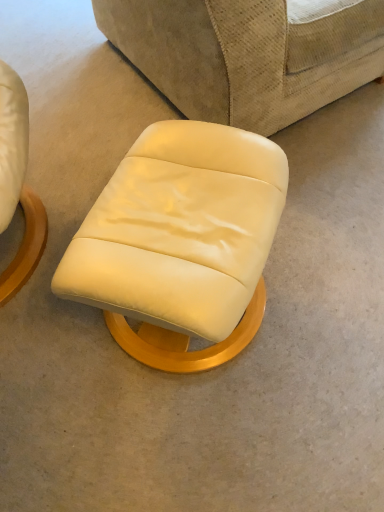
Image resolution: width=384 pixels, height=512 pixels. Find the location of `matte cream leather ottoman at center`. matte cream leather ottoman at center is located at coordinates (181, 242).

Describe the element at coordinates (181, 242) in the screenshot. I see `matte cream leather ottoman at center` at that location.

At what (x,y) coordinates should I click in order to perform the action: click on beige fabric studio couch at center. Please return your answer as a coordinate pair (x, y). Looking at the image, I should click on (246, 55).

Image resolution: width=384 pixels, height=512 pixels. Describe the element at coordinates (246, 55) in the screenshot. I see `beige fabric studio couch at center` at that location.

You are a GUI agent. You are given a task and a screenshot of the screen. Output one action in this format:
    pyautogui.click(x=<x>, y=<y>)
    Task: Click on the matte cream leather ottoman at center
    
    Given the screenshot: What is the action you would take?
    pyautogui.click(x=181, y=242)

From the picture: Does beige fabric studio couch at center appear on the left side of matte cream leather ottoman at center?

In fact, beige fabric studio couch at center is to the right of matte cream leather ottoman at center.

Does beige fabric studio couch at center come behind matte cream leather ottoman at center?

Yes, beige fabric studio couch at center is behind matte cream leather ottoman at center.

From the picture: Which is more distant, (183, 54) or (222, 279)?

Point (183, 54)

From the image's perspective, which one is positioned lower, beige fabric studio couch at center or matte cream leather ottoman at center?

matte cream leather ottoman at center, from the image's perspective.

From a real-world perspective, who is located higher, beige fabric studio couch at center or matte cream leather ottoman at center?

From a 3D spatial view, beige fabric studio couch at center is above.

Considering the relative sizes of beige fabric studio couch at center and matte cream leather ottoman at center in the image provided, is beige fabric studio couch at center wider than matte cream leather ottoman at center?

Correct, the width of beige fabric studio couch at center exceeds that of matte cream leather ottoman at center.

Can you confirm if beige fabric studio couch at center is shorter than matte cream leather ottoman at center?

No.

Does beige fabric studio couch at center have a larger size compared to matte cream leather ottoman at center?

Yes.

Is beige fabric studio couch at center surrounding matte cream leather ottoman at center?

No, matte cream leather ottoman at center is not surrounded by beige fabric studio couch at center.

Is beige fabric studio couch at center positioned far away from matte cream leather ottoman at center?

No, beige fabric studio couch at center is not far away from matte cream leather ottoman at center.

Is matte cream leather ottoman at center at the back of beige fabric studio couch at center?

No, beige fabric studio couch at center is not facing away from matte cream leather ottoman at center.

What are the coordinates of `studio couch on the right side of matte cream leather ottoman at center` in the screenshot? It's located at (246, 55).

Can you confirm if matte cream leather ottoman at center is positioned to the right of beige fabric studio couch at center?

No.

Relative to beige fabric studio couch at center, is matte cream leather ottoman at center in front or behind?

matte cream leather ottoman at center is in front of beige fabric studio couch at center.

Is point (195, 331) positioned behind point (118, 15)?

That is False.

From the image's perspective, which one is positioned lower, matte cream leather ottoman at center or beige fabric studio couch at center?

matte cream leather ottoman at center appears lower in the image.

From a real-world perspective, does matte cream leather ottoman at center stand above beige fabric studio couch at center?

No.

Which of these two, matte cream leather ottoman at center or beige fabric studio couch at center, is thinner?

Thinner between the two is matte cream leather ottoman at center.

Is matte cream leather ottoman at center taller than beige fabric studio couch at center?

No.

Consider the image. Considering the relative sizes of matte cream leather ottoman at center and beige fabric studio couch at center in the image provided, is matte cream leather ottoman at center bigger than beige fabric studio couch at center?

No, matte cream leather ottoman at center is not bigger than beige fabric studio couch at center.

Is matte cream leather ottoman at center located outside beige fabric studio couch at center?

matte cream leather ottoman at center is positioned outside beige fabric studio couch at center.

Is the surface of matte cream leather ottoman at center in direct contact with beige fabric studio couch at center?

No, matte cream leather ottoman at center is not touching beige fabric studio couch at center.

Is beige fabric studio couch at center at the back of matte cream leather ottoman at center?

No.

Identify the location of studio couch behind the matte cream leather ottoman at center. This screenshot has height=512, width=384. (246, 55).

Where is `chair below the beige fabric studio couch at center (from a real-world perspective)`? This screenshot has height=512, width=384. chair below the beige fabric studio couch at center (from a real-world perspective) is located at coordinates coord(181,242).

You are a GUI agent. You are given a task and a screenshot of the screen. Output one action in this format:
    pyautogui.click(x=<x>, y=<y>)
    Task: Click on the chair on the left of beige fabric studio couch at center
    The height and width of the screenshot is (512, 384).
    Given the screenshot: What is the action you would take?
    pyautogui.click(x=181, y=242)